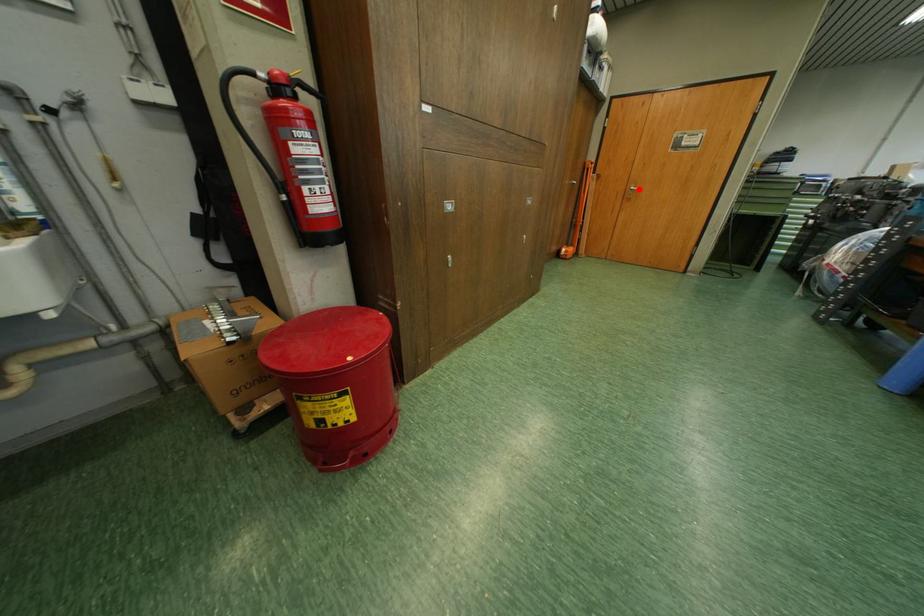
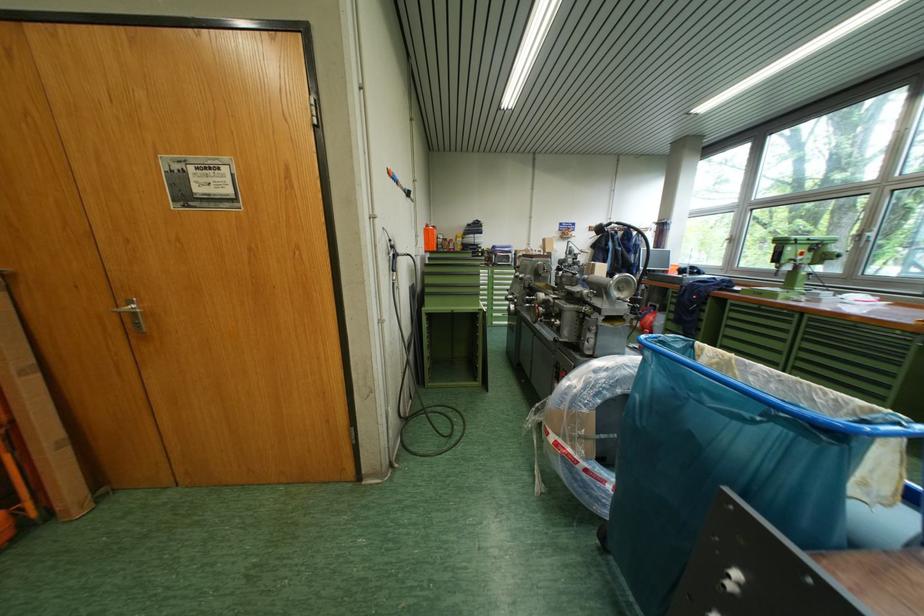
Question: A red point is marked in image1. In image2, is the corresponding 3D point closer to the camera or farther? Reply with the corresponding letter.

Choices:
 (A) The corresponding 3D point is closer.
 (B) The corresponding 3D point is farther.

Answer: (B)